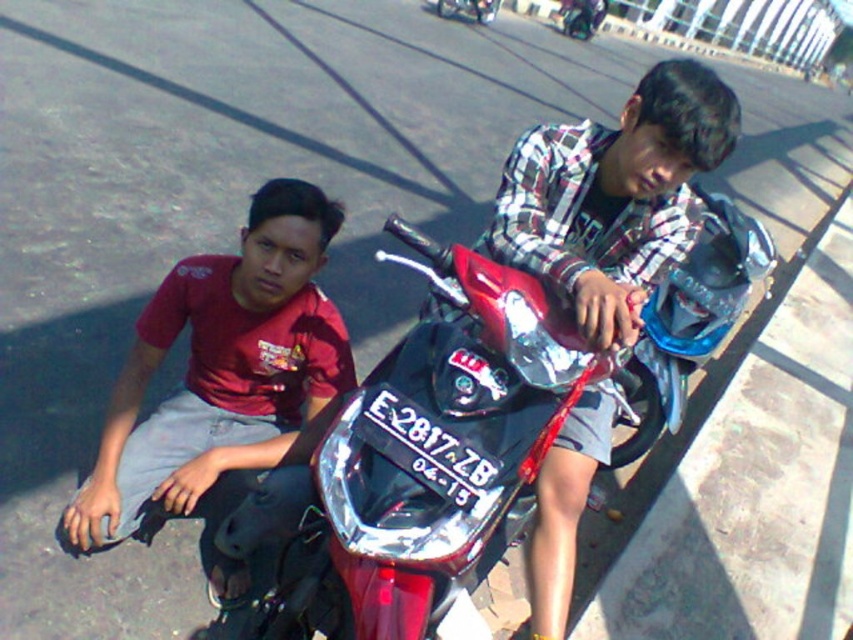
Question: Which is nearer to the matte red shirt at left?

Choices:
 (A) shiny metallic motorcycle at center
 (B) plaid shirt at center

Answer: (A)

Question: Is shiny metallic motorcycle at center wider than matte red shirt at left?

Choices:
 (A) yes
 (B) no

Answer: (A)

Question: Is shiny metallic motorcycle at center to the left of plaid shirt at center from the viewer's perspective?

Choices:
 (A) no
 (B) yes

Answer: (A)

Question: Which object appears farthest from the camera in this image?

Choices:
 (A) matte red shirt at left
 (B) shiny metallic motorcycle at center
 (C) plaid shirt at center

Answer: (A)

Question: Can you confirm if shiny metallic motorcycle at center is thinner than plaid shirt at center?

Choices:
 (A) no
 (B) yes

Answer: (A)

Question: Which object is farther from the camera taking this photo?

Choices:
 (A) plaid shirt at center
 (B) matte red shirt at left
 (C) shiny metallic motorcycle at center

Answer: (B)